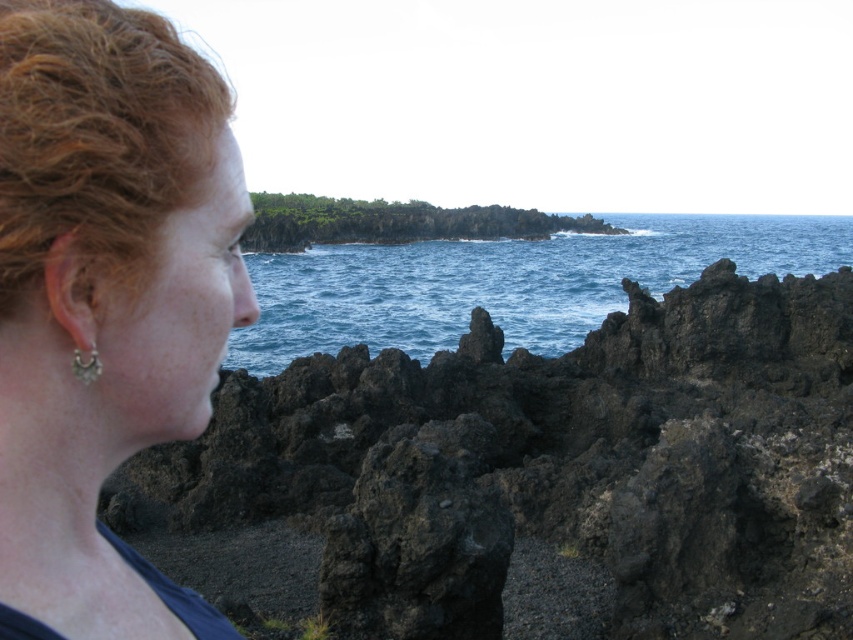
You are standing in the coastal scene and want to take a photo of the black volcanic rock at center and the matte black hair at left. Which object should you focus on first if you want to capture both in sharp focus?

The black volcanic rock at center is above the matte black hair at left, so you should focus on the black volcanic rock at center first to ensure both are in sharp focus.

Based on the scene description, where is the curly auburn hair at left located in terms of coordinates?

The curly auburn hair at left is located at coordinates point (96, 136).